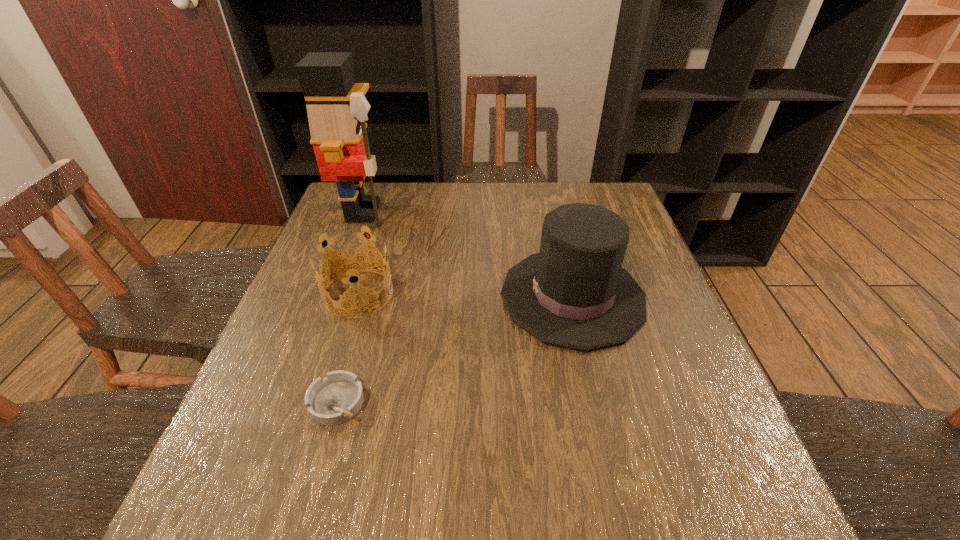
Locate an element on the screen. This screenshot has width=960, height=540. vacant space at the near edge is located at coordinates (653, 485).

Locate an element on the screen. This screenshot has width=960, height=540. vacant space at the left edge of the desktop is located at coordinates (260, 386).

In the image, there is a desktop. Where is `vacant space at the right edge`? The image size is (960, 540). vacant space at the right edge is located at coordinates (632, 346).

Locate an element on the screen. vacant space at the far right corner of the desktop is located at coordinates 577,184.

At what (x,y) coordinates should I click in order to perform the action: click on vacant space at the near right corner of the desktop. Please return your answer as a coordinate pair (x, y). This screenshot has height=540, width=960. Looking at the image, I should click on (696, 520).

Locate an element on the screen. unoccupied position between the tallest object and the second tallest object is located at coordinates (468, 254).

This screenshot has width=960, height=540. Identify the location of vacant space that is in between the shortest object and the crown. (348, 348).

Locate an element on the screen. free space between the rightmost object and the crown is located at coordinates (466, 295).

Identify the location of free space between the second shortest object and the nearest object. This screenshot has width=960, height=540. (348, 348).

You are a GUI agent. You are given a task and a screenshot of the screen. Output one action in this format:
    pyautogui.click(x=<x>, y=<y>)
    Task: Click on the empty space that is in between the nearest object and the crown
    This screenshot has width=960, height=540.
    Given the screenshot: What is the action you would take?
    pyautogui.click(x=348, y=348)